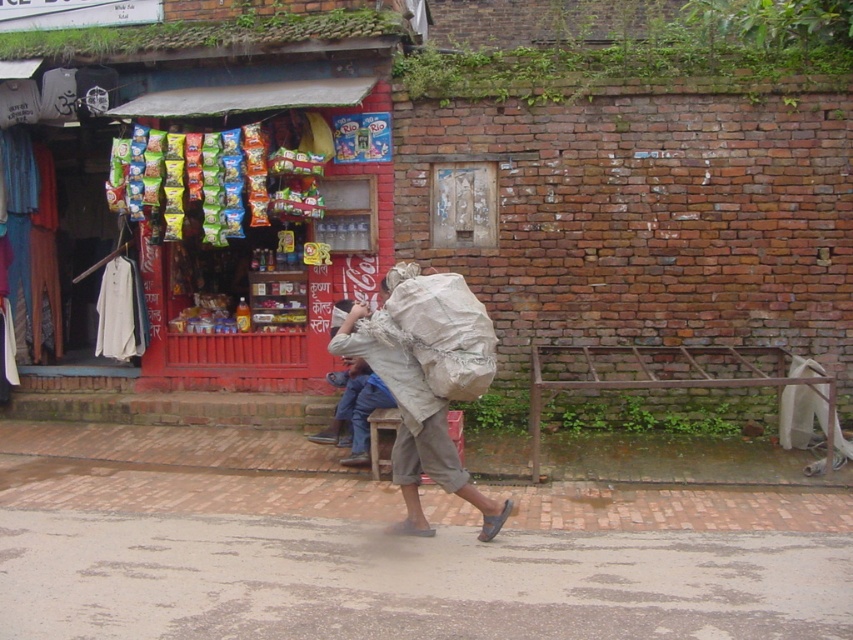
Between red brick wall at upper center and white paper sack at center, which one is positioned lower?

Positioned lower is white paper sack at center.

Can you confirm if red brick wall at upper center is positioned above white paper sack at center?

Yes, red brick wall at upper center is above white paper sack at center.

Is point (277, 97) behind point (405, 476)?

Yes, point (277, 97) is farther from viewer.

This screenshot has height=640, width=853. I want to click on red brick wall at upper center, so click(180, 122).